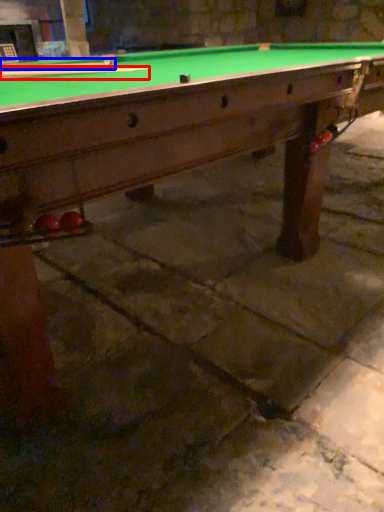
Question: Which object is closer to the camera taking this photo, cue (highlighted by a red box) or cue (highlighted by a blue box)?

Choices:
 (A) cue
 (B) cue

Answer: (B)